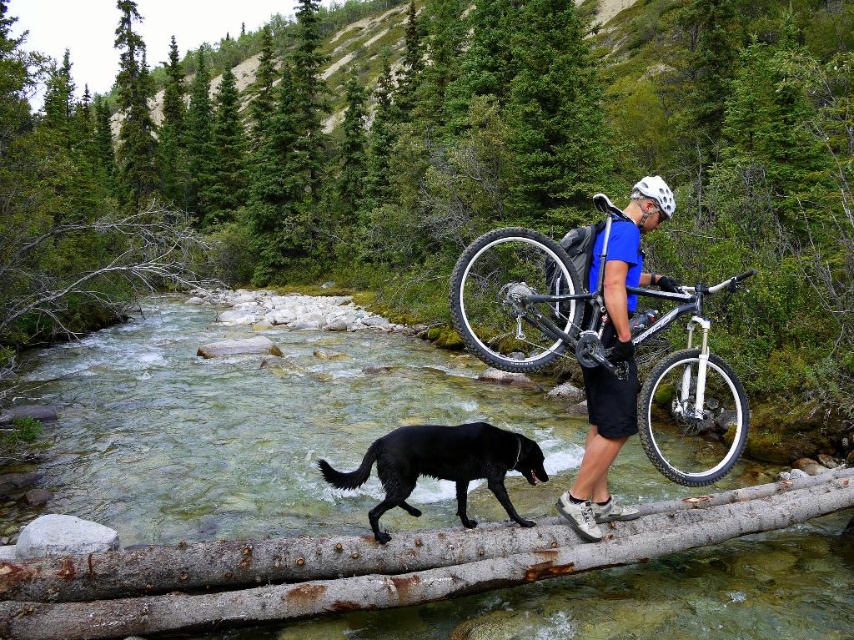
Looking at the scene, where is the black rubber bicycle wheel at center in relation to the white rubber tire at center?

The black rubber bicycle wheel at center is to the left of the white rubber tire at center.

You are a hiker who needs to cross the stream shown in the image. There is a fallen tree trunk that you can use as a bridge. However, you notice a point marked at coordinates (516, 300) which corresponds to a black rubber bicycle wheel at center. What object at that coordinate might pose a risk to your balance while crossing the fallen tree trunk?

The black rubber bicycle wheel at center located at point (516, 300) might pose a risk to your balance because it could be slippery or unstable underfoot while crossing the fallen tree trunk.

You are a hiker who needs to cross the stream while carrying your bicycle. The black rubber bicycle wheel at center is positioned at point 0.469, 0.605. Can you safely cross the stream without getting the wheel submerged in water?

The black rubber bicycle wheel at center is positioned at point (x=516, y=300), which is on the fallen tree trunk spanning the stream. Since the trunk provides a dry path, you can safely cross without submerging the wheel.